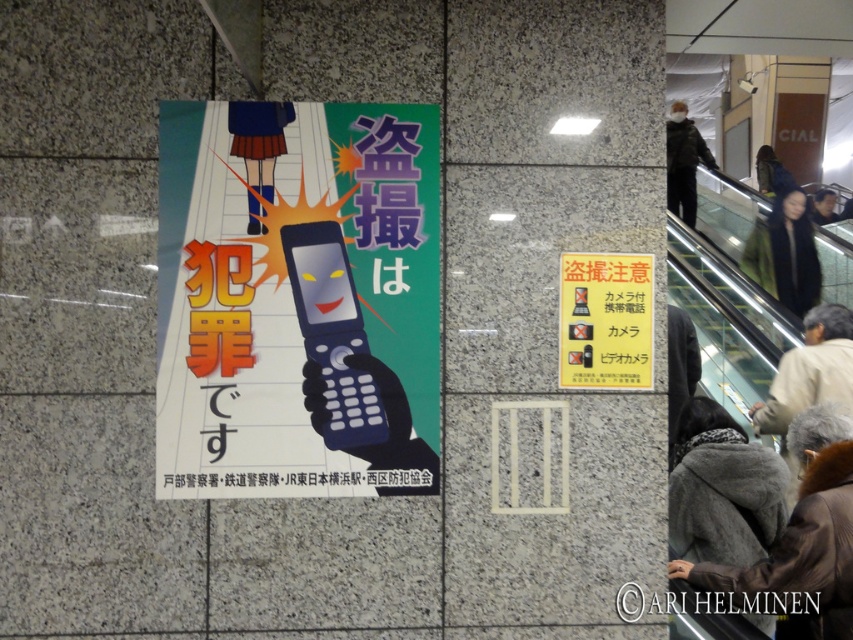
You are standing at the entrance of the subway station and see the light beige jacket at lower right. Where is the light beige jacket located relative to the point marked at coordinates (810, 371)?

The point marked at coordinates (810, 371) is exactly where the light beige jacket at lower right is located.

You are a person standing in the subway station and you see the black fabric at upper right and the dark gray jacket at upper right. Can you reach both items at the same time if you stretch your arms out as far as you can? Please explain your reasoning.

The black fabric at upper right is 3.67 feet away from the dark gray jacket at upper right. The average human arm span is about 3 feet. Since the distance between them is greater than your arm span, you cannot reach both items simultaneously.

You are a tourist in Japan and see the orange glossy sign at upper right and the black fabric at upper right. According to the spatial arrangement, which object is positioned to the left?

The orange glossy sign at upper right is positioned to the left of the black fabric at upper right.